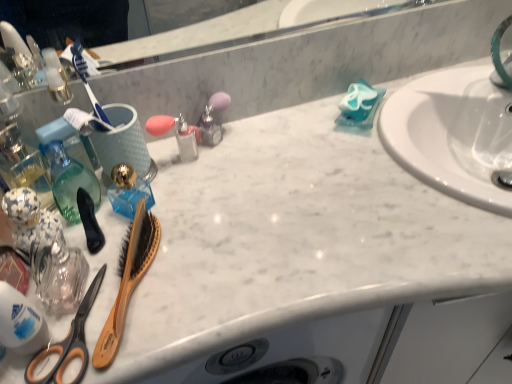
I want to click on vacant area on the back side of orange-handled scissors at lower left, so click(x=129, y=228).